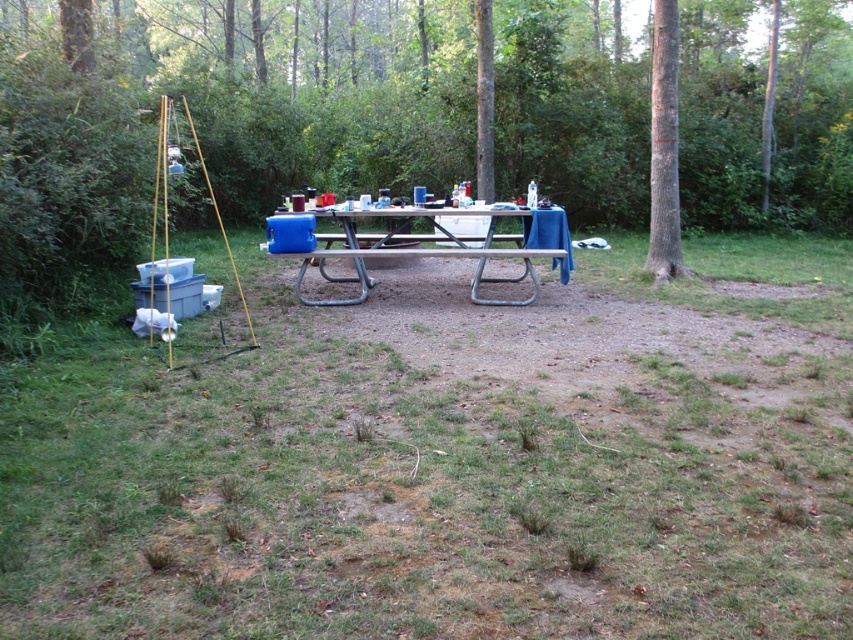
Who is lower down, white plastic table at center or smooth gray bark at right?

Positioned lower is white plastic table at center.

Does white plastic table at center appear on the left side of smooth gray bark at right?

Yes, white plastic table at center is to the left of smooth gray bark at right.

The height and width of the screenshot is (640, 853). What do you see at coordinates (442, 246) in the screenshot?
I see `white plastic table at center` at bounding box center [442, 246].

Locate an element on the screen. The image size is (853, 640). white plastic table at center is located at coordinates (442, 246).